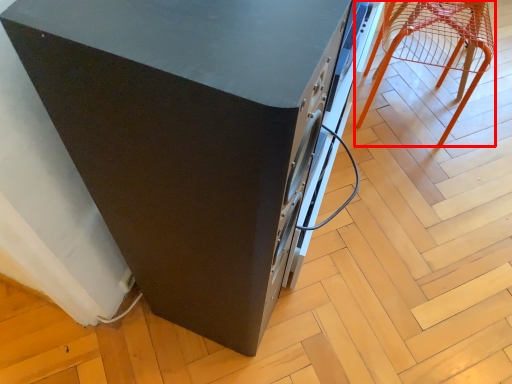
Question: From the image's perspective, where is furniture (annotated by the red box) located relative to home appliance?

Choices:
 (A) above
 (B) below

Answer: (A)